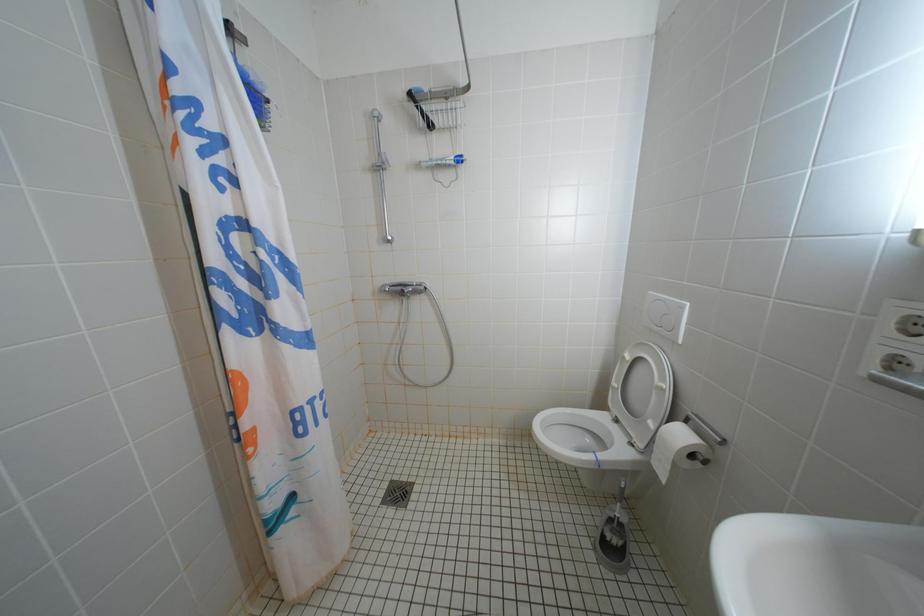
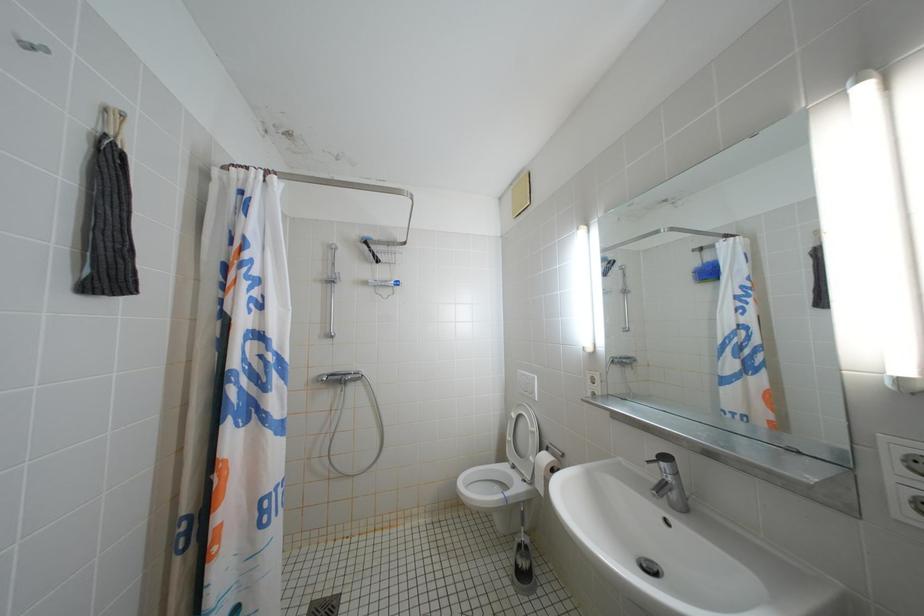
The first image is from the beginning of the video and the second image is from the end. How did the camera likely rotate when shooting the video?

The rotation direction of the camera is right-up.